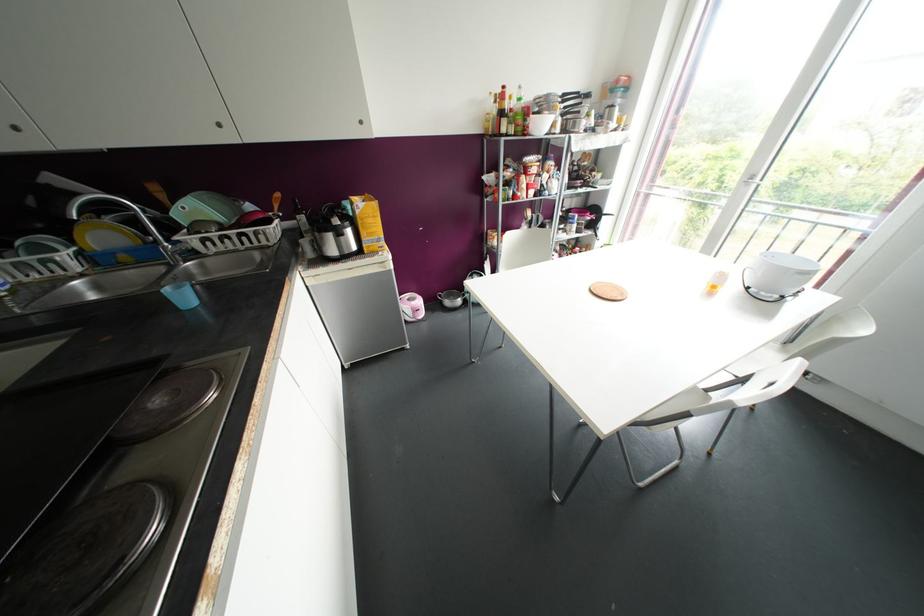
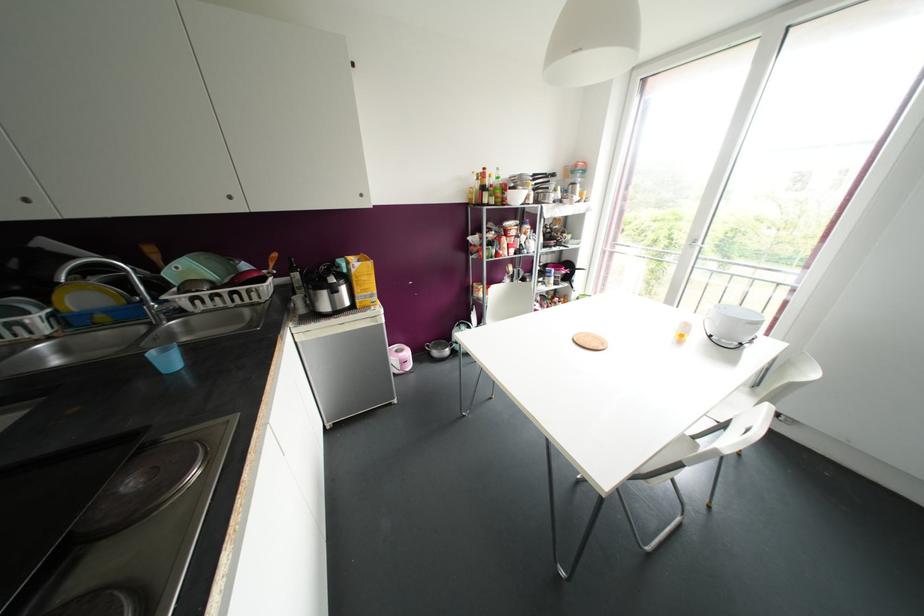
In the second image, find the point that corresponds to the point at 184,297 in the first image.

(168, 361)